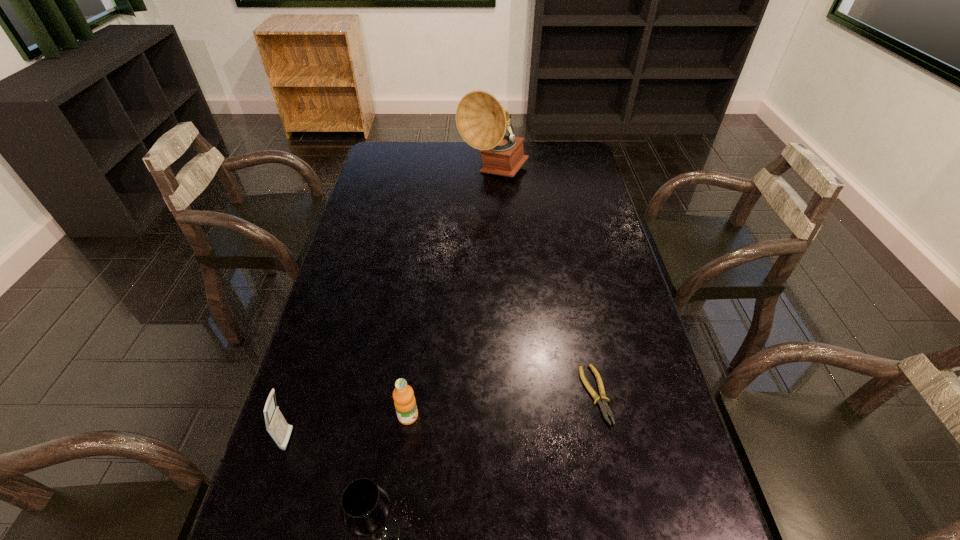
Locate an element on the screen. free point between the cellular telephone and the fourth tallest object is located at coordinates (348, 428).

What are the coordinates of `object that stands as the fourth closest to the orange juice` in the screenshot? It's located at (481, 120).

At what (x,y) coordinates should I click in order to perform the action: click on object that is the closest to the nearest object. Please return your answer as a coordinate pair (x, y). The height and width of the screenshot is (540, 960). Looking at the image, I should click on (403, 395).